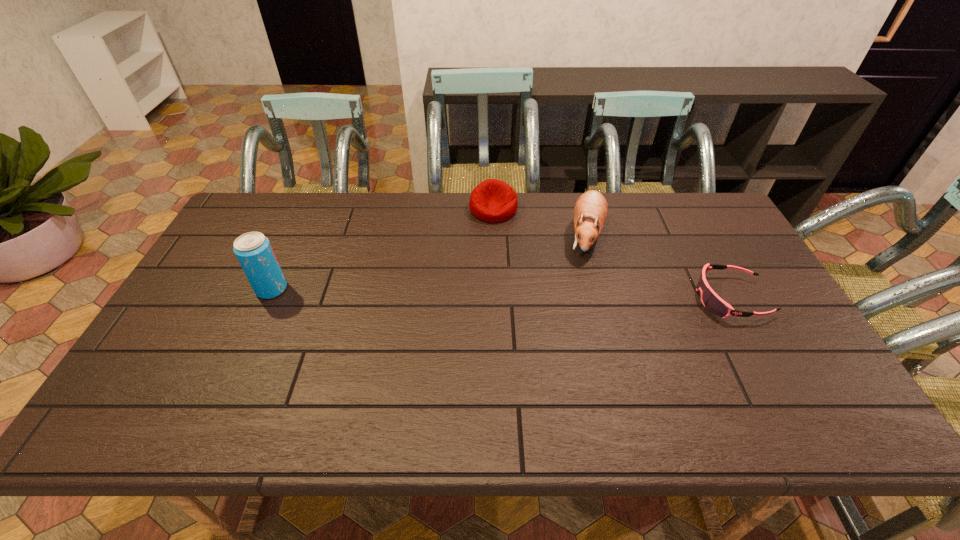
Where is `free space located 0.160m on the front-facing side of the shortest object`? This screenshot has height=540, width=960. free space located 0.160m on the front-facing side of the shortest object is located at coordinates (638, 298).

Where is `vacant space located on the front-facing side of the shortest object`? This screenshot has width=960, height=540. vacant space located on the front-facing side of the shortest object is located at coordinates (552, 298).

This screenshot has height=540, width=960. I want to click on blank area located 0.060m at the face of the third object from left to right, so click(581, 275).

What are the coordinates of `free space located 0.080m at the face of the third object from left to right` in the screenshot? It's located at (579, 279).

You are a GUI agent. You are given a task and a screenshot of the screen. Output one action in this format:
    pyautogui.click(x=<x>, y=<y>)
    Task: Click on the free spot located 0.280m at the face of the third object from left to right
    
    Given the screenshot: What is the action you would take?
    pyautogui.click(x=561, y=329)

Locate an element on the screen. The image size is (960, 540). vacant space located on the seat area of the second shortest object is located at coordinates (507, 252).

At what (x,y) coordinates should I click in order to perform the action: click on vacant space located on the seat area of the second shortest object. Please return your answer as a coordinate pair (x, y). Image resolution: width=960 pixels, height=540 pixels. Looking at the image, I should click on (508, 256).

What are the coordinates of `vacant space situated 0.240m on the seat area of the second shortest object` in the screenshot? It's located at (514, 274).

The image size is (960, 540). I want to click on hamster that is at the far edge, so click(590, 212).

This screenshot has width=960, height=540. In order to click on beanbag situated at the far edge in this screenshot , I will do 493,201.